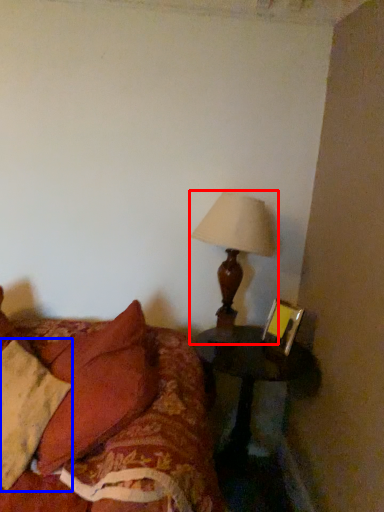
Question: Which point is further to the camera, lamp (highlighted by a red box) or pillow (highlighted by a blue box)?

Choices:
 (A) lamp
 (B) pillow

Answer: (A)